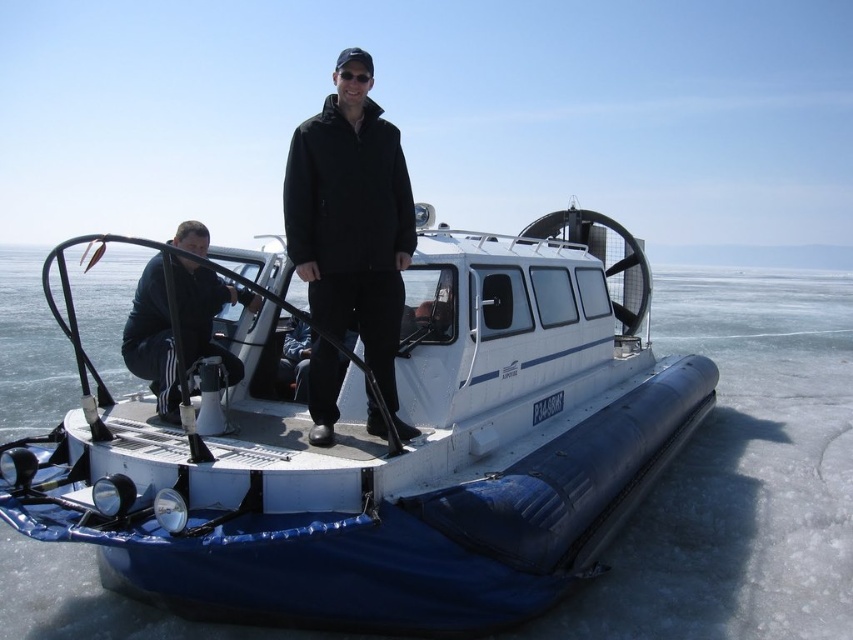
You are planning to transport a large equipment box that is 2 meters wide. You see the white rubber hovercraft at center and the black matte jacket at lower left in the scene. Which object can accommodate the width of the equipment box?

The black matte jacket at lower left can accommodate the equipment box since the white rubber hovercraft at center is narrower than the black matte jacket at lower left.

You are taking a photo of the hovercraft and want to focus on both the standing person and the seated person. Which point, point (230,560) or point (151,268), is closer to your camera lens?

Point (230,560) is closer to the camera lens than point (151,268).